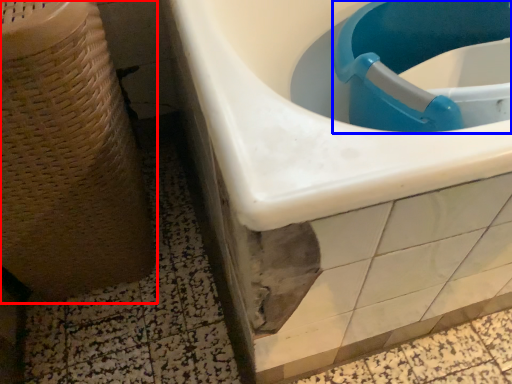
Question: Which point is closer to the camera, potty (highlighted by a red box) or sink (highlighted by a blue box)?

Choices:
 (A) potty
 (B) sink

Answer: (A)